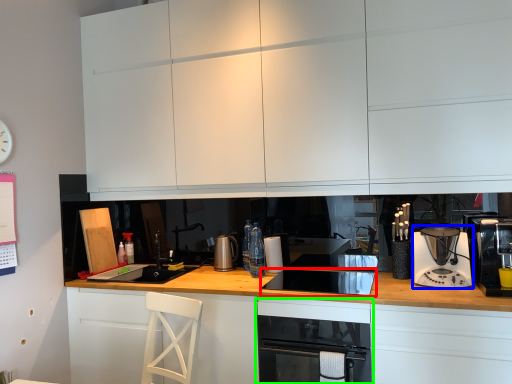
Question: Which object is the farthest from appliance (highlighted by a red box)? Choose among these: kitchen appliance (highlighted by a blue box) or home appliance (highlighted by a green box).

Choices:
 (A) kitchen appliance
 (B) home appliance

Answer: (A)